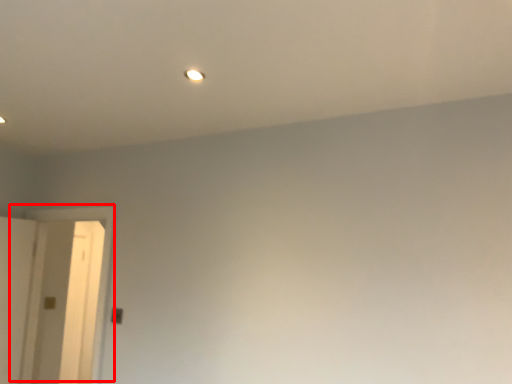
Question: Observing the image, what is the correct spatial positioning of door (annotated by the red box) in reference to light?

Choices:
 (A) right
 (B) left

Answer: (B)